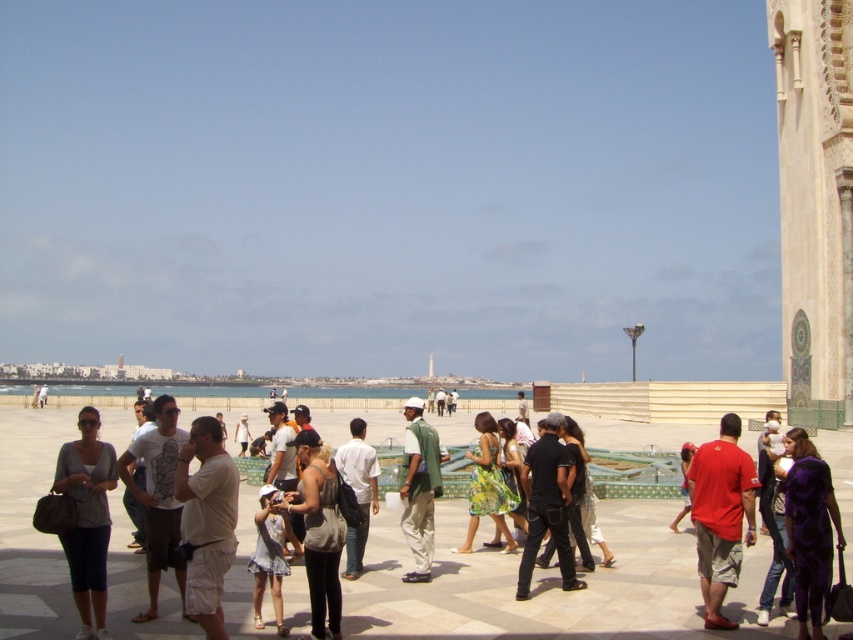
Question: Is white cotton dress at center positioned before matte red shirt at center?

Choices:
 (A) no
 (B) yes

Answer: (B)

Question: From the image, what is the correct spatial relationship of purple satin dress at lower right in relation to floral dress at center?

Choices:
 (A) above
 (B) below

Answer: (A)

Question: Can you confirm if purple satin dress at lower right is wider than floral dress at center?

Choices:
 (A) yes
 (B) no

Answer: (B)

Question: Which point is closer to the camera?

Choices:
 (A) (550, 432)
 (B) (808, 552)
 (C) (793, 342)

Answer: (B)

Question: Which is nearer to the purple satin dress at lower right?

Choices:
 (A) black matte pants at center
 (B) white cotton dress at center
 (C) floral dress at center

Answer: (A)

Question: Which point is farther from the camera taking this photo?

Choices:
 (A) (492, 476)
 (B) (686, 509)
 (C) (550, 516)
 (D) (502, 449)

Answer: (B)